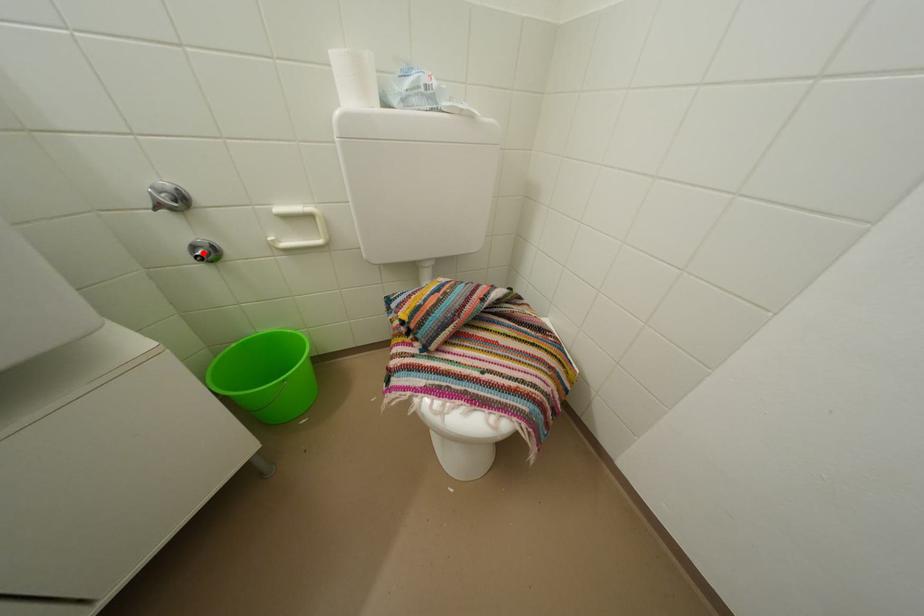
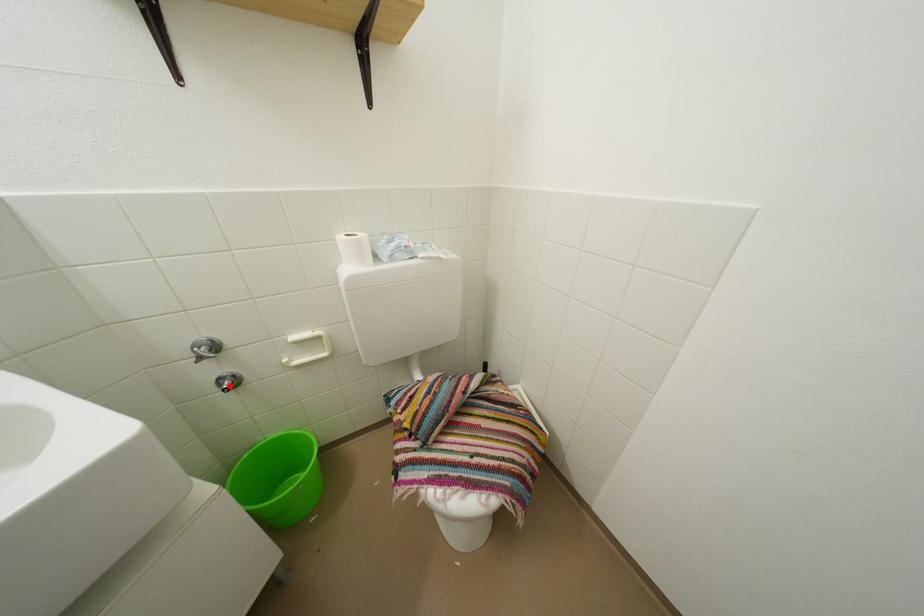
I am providing you with two images of the same scene from different viewpoints. A red point is marked on the first image and another point is marked on the second image. Does the point marked in image1 correspond to the same location as the one in image2?

Yes